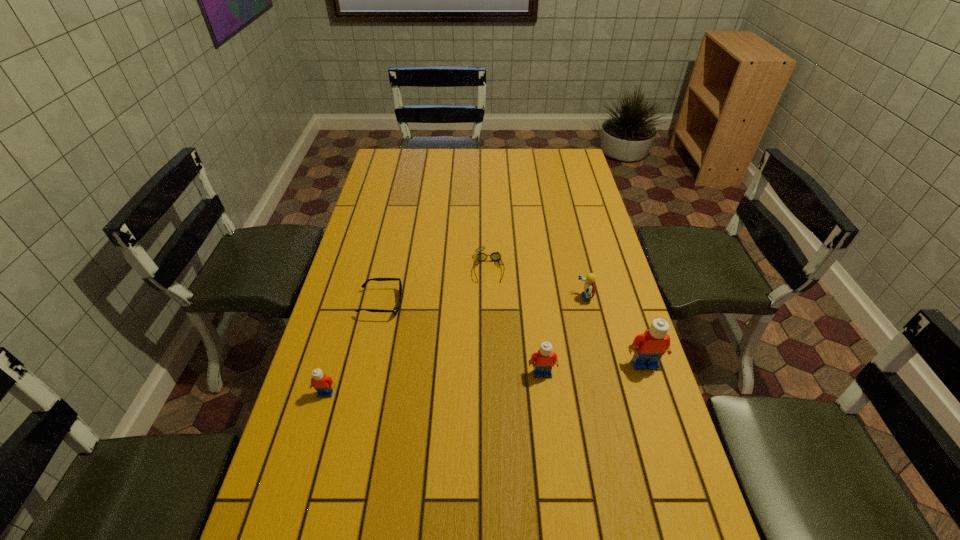
At what (x,y) coordinates should I click in order to perform the action: click on the leftmost Lego. Please return your answer as a coordinate pair (x, y). The width and height of the screenshot is (960, 540). Looking at the image, I should click on (323, 384).

What are the coordinates of `the nearest object` in the screenshot? It's located at (323, 384).

At what (x,y) coordinates should I click in order to perform the action: click on the third Lego from right to left. Please return your answer as a coordinate pair (x, y). The image size is (960, 540). Looking at the image, I should click on (544, 359).

The image size is (960, 540). Find the location of `the fifth shortest object`. the fifth shortest object is located at coordinates (544, 359).

What are the coordinates of `the tallest object` in the screenshot? It's located at (648, 348).

Image resolution: width=960 pixels, height=540 pixels. In order to click on the rightmost Lego in this screenshot , I will do `click(648, 348)`.

Find the location of a particular element. The image size is (960, 540). the third object from left to right is located at coordinates (495, 256).

The height and width of the screenshot is (540, 960). Find the location of `the farthest object`. the farthest object is located at coordinates (495, 256).

Identify the location of the farthest Lego. (589, 287).

Where is `the second object from right to left`? The width and height of the screenshot is (960, 540). the second object from right to left is located at coordinates (589, 287).